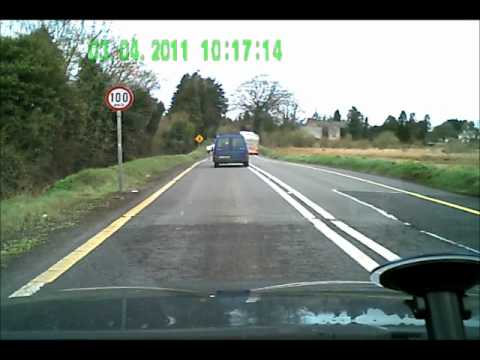
Identify the location of door way. The width and height of the screenshot is (480, 360). (323, 132).